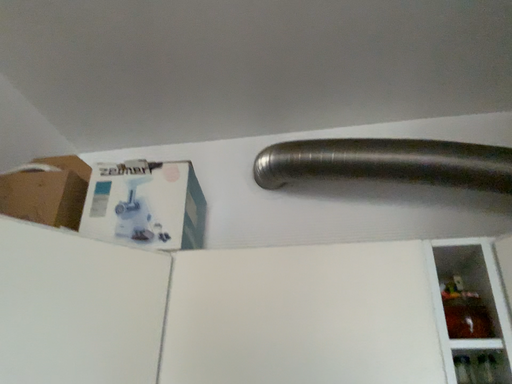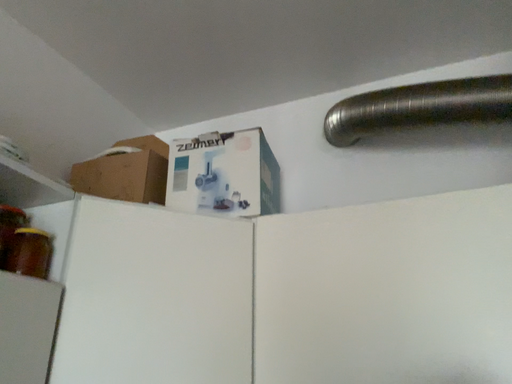
Question: How did the camera likely rotate when shooting the video?

Choices:
 (A) rotated right
 (B) rotated left

Answer: (B)